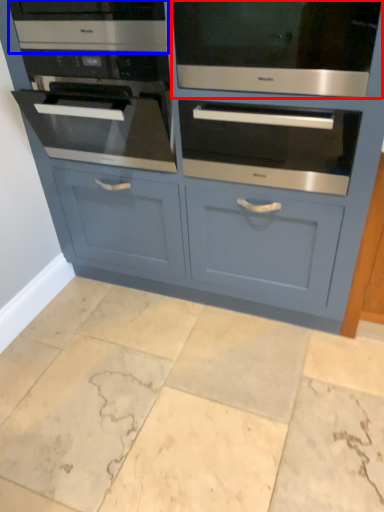
Question: Which point is further to the camera, oven (highlighted by a red box) or appliance (highlighted by a blue box)?

Choices:
 (A) oven
 (B) appliance

Answer: (B)